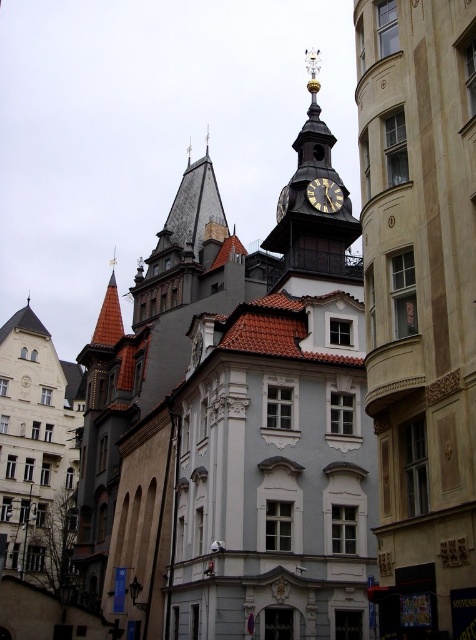
You are an architect analyzing the urban scene. You observe the gold metallic clock tower at upper center and the gold metallic clock at upper center. Which of these two objects is taller?

The gold metallic clock tower at upper center is taller than the gold metallic clock at upper center.